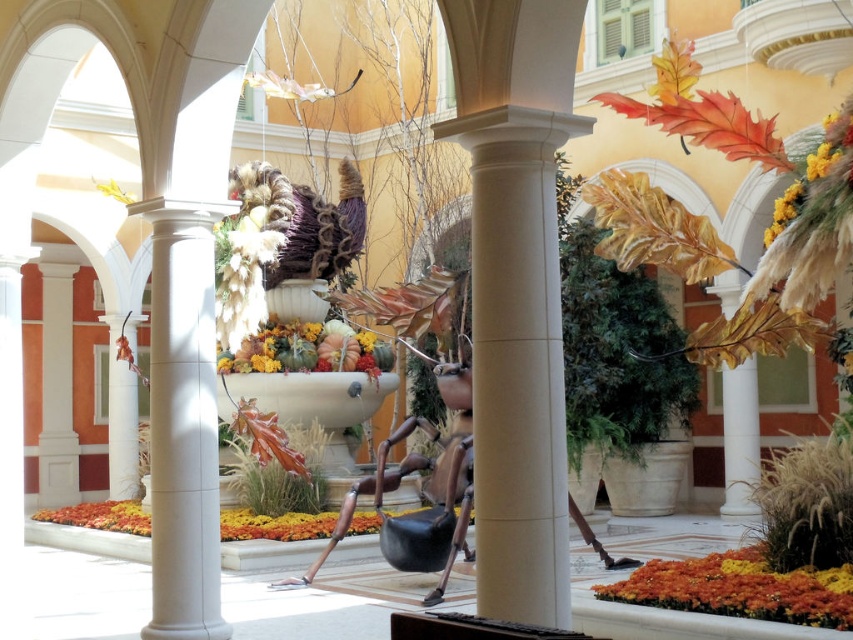
You are a florist arranging a display in the courtyard. You have two items to place near the fountain. The orange matte flowers at lower right and the multicolored fabric bouquet at center. Which one should you place closer to the fountain to ensure it is more visible to visitors approaching from the entrance?

The multicolored fabric bouquet at center should be placed closer to the fountain because it is taller than the orange matte flowers at lower right, making it more visible to visitors approaching from the entrance.

You are a maintenance worker needing to water the orange matte flowers at lower right and the multicolored fabric bouquet at center. Your watering can has a range of 15 feet. Can you water both from the same spot without moving?

The distance between the orange matte flowers at lower right and the multicolored fabric bouquet at center is 17.98 feet. Since your watering can only reaches 15 feet, you cannot water both from the same spot without moving.